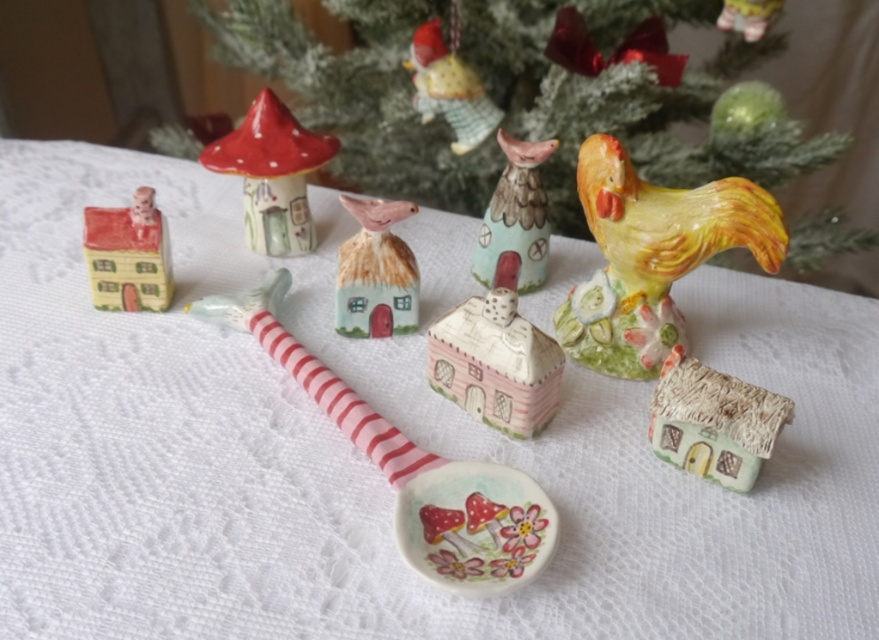
From the picture: Does pink matte house at center have a lesser width compared to matte ceramic elf at center?

No, pink matte house at center is not thinner than matte ceramic elf at center.

Does point (511, 289) come farther from viewer compared to point (404, 280)?

Yes, it is.

The width and height of the screenshot is (879, 640). Identify the location of pink matte house at center. (495, 364).

Does yellow glossy ceramic rooster at upper right have a greater height compared to pink matte house at center?

Yes.

Is yellow glossy ceramic rooster at upper right to the left of pink matte house at center from the viewer's perspective?

No, yellow glossy ceramic rooster at upper right is not to the left of pink matte house at center.

What do you see at coordinates (654, 252) in the screenshot? This screenshot has width=879, height=640. I see `yellow glossy ceramic rooster at upper right` at bounding box center [654, 252].

Where is `yellow glossy ceramic rooster at upper right`? The height and width of the screenshot is (640, 879). yellow glossy ceramic rooster at upper right is located at coordinates (654, 252).

Does point (746, 422) lie behind point (266, 157)?

No.

Which is below, matte green house at lower right or matte ceramic mushroom at center?

Positioned lower is matte green house at lower right.

Where is `matte green house at lower right`? This screenshot has height=640, width=879. matte green house at lower right is located at coordinates (714, 422).

The width and height of the screenshot is (879, 640). What are the coordinates of `matte green house at lower right` in the screenshot? It's located at (714, 422).